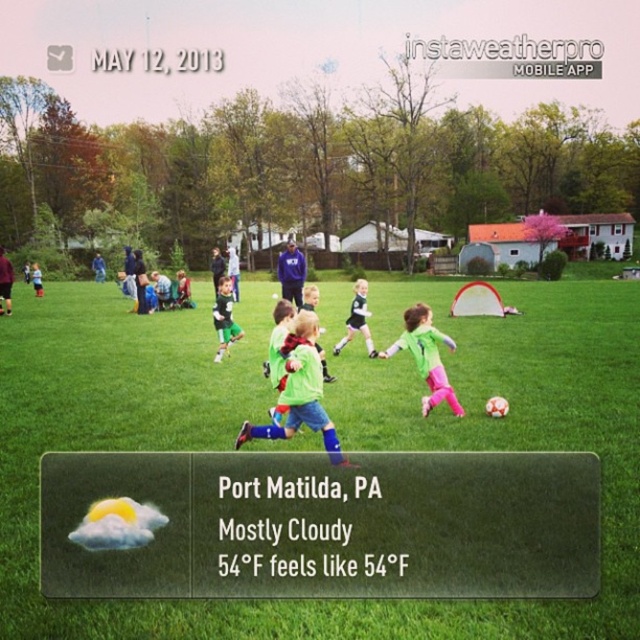
Is green grass at center behind green matte shirt at center?

No, it is in front of green matte shirt at center.

Which is below, green grass at center or green matte shirt at center?

green matte shirt at center is below.

Where is `green grass at center`? This screenshot has height=640, width=640. green grass at center is located at coordinates (339, 433).

Is green matte shirt at center further to the viewer compared to light blue jersey at center?

No, it is not.

Find the location of a particular element. The width and height of the screenshot is (640, 640). green matte shirt at center is located at coordinates (426, 356).

The width and height of the screenshot is (640, 640). In order to click on green matte shirt at center in this screenshot , I will do `click(426, 356)`.

Can you confirm if green grass at center is wider than light blue jersey at center?

Yes.

Is point (381, 406) positioned behind point (362, 292)?

No, (381, 406) is closer to viewer.

Where is `green grass at center`? The height and width of the screenshot is (640, 640). green grass at center is located at coordinates (339, 433).